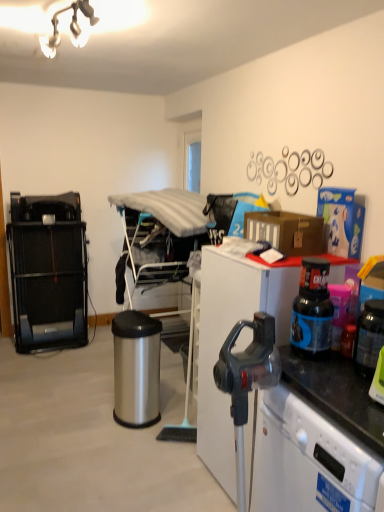
Locate an element on the screen. empty space that is ontop of brown cardboard box at upper right (from a real-world perspective) is located at coordinates (278, 214).